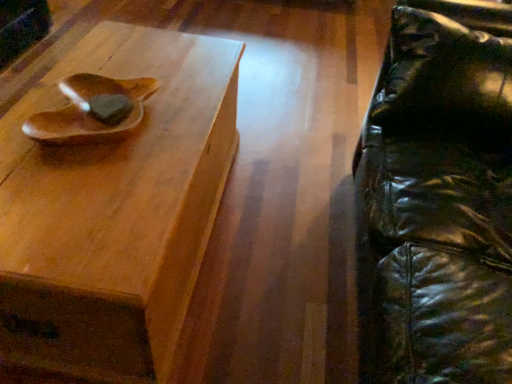
Question: From a real-world perspective, does wooden bowl at upper left stand above black leather swivel chair at right?

Choices:
 (A) no
 (B) yes

Answer: (B)

Question: Is wooden bowl at upper left positioned before black leather swivel chair at right?

Choices:
 (A) no
 (B) yes

Answer: (A)

Question: Considering the relative sizes of wooden bowl at upper left and black leather swivel chair at right in the image provided, is wooden bowl at upper left smaller than black leather swivel chair at right?

Choices:
 (A) yes
 (B) no

Answer: (A)

Question: Can you confirm if wooden bowl at upper left is shorter than black leather swivel chair at right?

Choices:
 (A) yes
 (B) no

Answer: (A)

Question: Is wooden bowl at upper left behind black leather swivel chair at right?

Choices:
 (A) yes
 (B) no

Answer: (A)

Question: Does wooden bowl at upper left appear on the left side of black leather swivel chair at right?

Choices:
 (A) no
 (B) yes

Answer: (B)

Question: Can you confirm if wooden tray at upper left is shorter than wooden bowl at upper left?

Choices:
 (A) no
 (B) yes

Answer: (A)

Question: Is wooden tray at upper left thinner than wooden bowl at upper left?

Choices:
 (A) no
 (B) yes

Answer: (A)

Question: Can you confirm if wooden tray at upper left is taller than wooden bowl at upper left?

Choices:
 (A) yes
 (B) no

Answer: (A)

Question: Are wooden tray at upper left and wooden bowl at upper left making contact?

Choices:
 (A) no
 (B) yes

Answer: (A)

Question: Is wooden bowl at upper left located within wooden tray at upper left?

Choices:
 (A) no
 (B) yes

Answer: (A)

Question: Considering the relative positions of wooden tray at upper left and wooden bowl at upper left in the image provided, is wooden tray at upper left in front of wooden bowl at upper left?

Choices:
 (A) yes
 (B) no

Answer: (A)

Question: Can you confirm if wooden bowl at upper left is smaller than wooden tray at upper left?

Choices:
 (A) yes
 (B) no

Answer: (A)